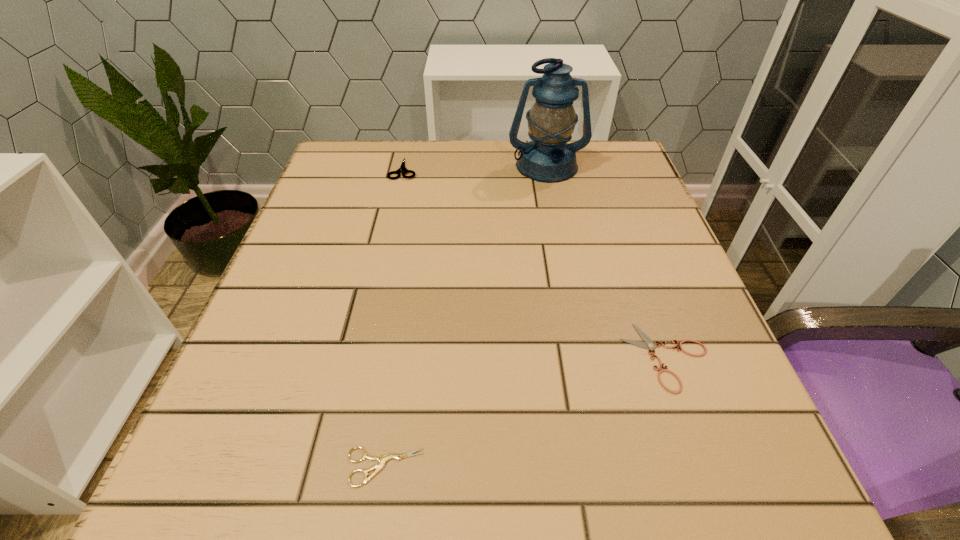
Where is `free point between the third shortest object and the nearest object`? free point between the third shortest object and the nearest object is located at coordinates (394, 318).

Where is `empty space between the second farthest shears and the tallest shears`? empty space between the second farthest shears and the tallest shears is located at coordinates (535, 263).

The height and width of the screenshot is (540, 960). In order to click on free spot between the farthest shears and the third farthest object in this screenshot , I will do `click(535, 263)`.

Locate an element on the screen. This screenshot has height=540, width=960. free spot between the tallest object and the third shortest object is located at coordinates (475, 167).

Locate an element on the screen. This screenshot has width=960, height=540. vacant point located between the nearest shears and the tallest object is located at coordinates (466, 316).

You are a GUI agent. You are given a task and a screenshot of the screen. Output one action in this format:
    pyautogui.click(x=<x>, y=<y>)
    Task: Click on the object that is the second closest to the lantern
    The height and width of the screenshot is (540, 960).
    Given the screenshot: What is the action you would take?
    pyautogui.click(x=648, y=343)

Choose which object is the second nearest neighbor to the nearest object. Please provide its 2D coordinates. Your answer should be formatted as a tuple, i.e. [(x, y)], where the tuple contains the x and y coordinates of a point satisfying the conditions above.

[(402, 168)]

Locate an element on the screen. the second closest shears to the tallest object is located at coordinates (648, 343).

You are a GUI agent. You are given a task and a screenshot of the screen. Output one action in this format:
    pyautogui.click(x=<x>, y=<y>)
    Task: Click on the shears that stands as the closest to the nearest shears
    The width and height of the screenshot is (960, 540).
    Given the screenshot: What is the action you would take?
    pyautogui.click(x=648, y=343)

You are a GUI agent. You are given a task and a screenshot of the screen. Output one action in this format:
    pyautogui.click(x=<x>, y=<y>)
    Task: Click on the blank area in the image that satisfies the following two spatial constraints: 1. on the face of the second farthest shears; 2. on the right side of the lantern
    Image resolution: width=960 pixels, height=540 pixels.
    Given the screenshot: What is the action you would take?
    pyautogui.click(x=586, y=356)